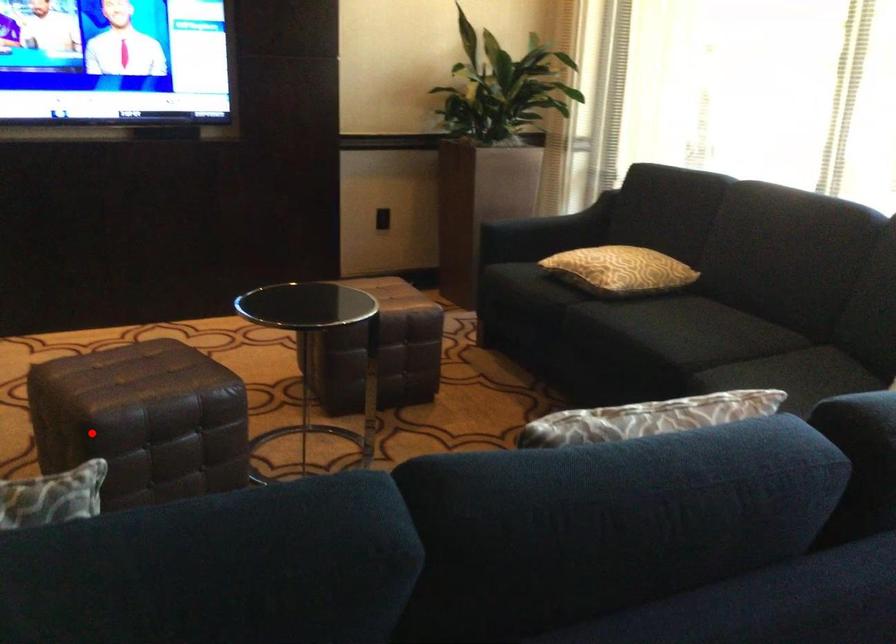
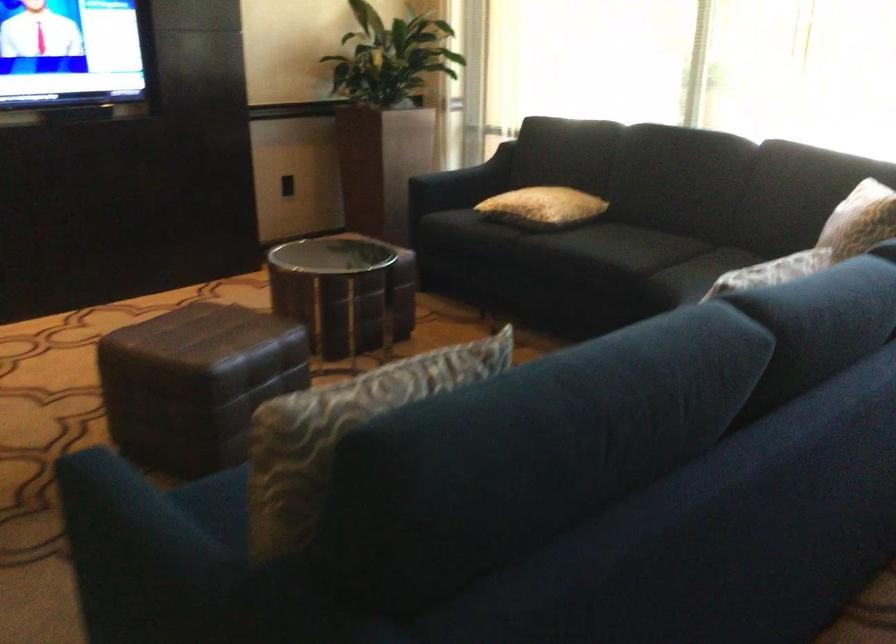
Question: I am providing you with two images of the same scene from different viewpoints. Given a red point in image1, look at the same physical point in image2. Is it:

Choices:
 (A) Closer to the viewpoint
 (B) Farther from the viewpoint

Answer: (B)